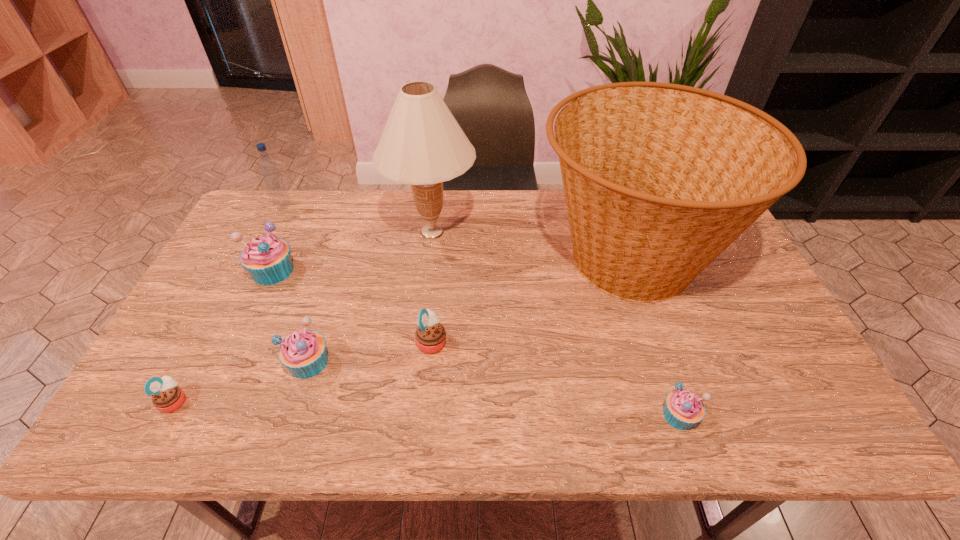
Where is `the smaller pink muffin`? The width and height of the screenshot is (960, 540). the smaller pink muffin is located at coordinates (167, 397).

The height and width of the screenshot is (540, 960). Find the location of `the left pink muffin`. the left pink muffin is located at coordinates (167, 397).

The width and height of the screenshot is (960, 540). What are the coordinates of `the nearest blue muffin` in the screenshot? It's located at (683, 409).

The height and width of the screenshot is (540, 960). In order to click on the rightmost muffin in this screenshot , I will do `click(683, 409)`.

Find the location of a particular element. vacant space located 0.320m on the front of the lampshade is located at coordinates (419, 351).

Where is `vacant region located on the front of the basket`? vacant region located on the front of the basket is located at coordinates coord(691,442).

Find the location of `vacant area situated on the front of the third tallest object`. vacant area situated on the front of the third tallest object is located at coordinates (264, 245).

In order to click on free space located on the back of the farthest blue muffin in this screenshot , I will do `click(292, 230)`.

The image size is (960, 540). In order to click on vacant space situated on the front-facing side of the bigger pink muffin in this screenshot , I will do `click(517, 341)`.

You are a GUI agent. You are given a task and a screenshot of the screen. Output one action in this format:
    pyautogui.click(x=<x>, y=<y>)
    Task: Click on the free space located on the left of the second blue muffin from left to right
    The image size is (960, 540).
    Given the screenshot: What is the action you would take?
    pyautogui.click(x=237, y=362)